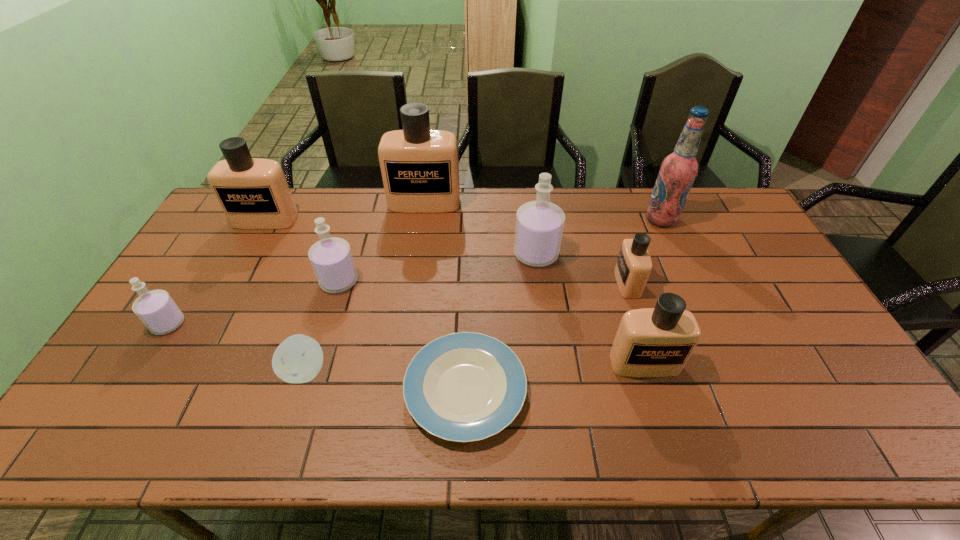
Identify the location of the third biggest beige perfume. (651, 342).

What are the coordinates of `the smallest beige perfume` in the screenshot? It's located at (634, 264).

Where is `the seventh farthest object`? Image resolution: width=960 pixels, height=540 pixels. the seventh farthest object is located at coordinates (156, 309).

You are a GUI agent. You are given a task and a screenshot of the screen. Output one action in this format:
    pyautogui.click(x=<x>, y=<y>)
    Task: Click on the leftmost purple perfume
    
    Given the screenshot: What is the action you would take?
    pyautogui.click(x=156, y=309)

Locate an element on the screen. The width and height of the screenshot is (960, 540). white apple is located at coordinates (298, 359).

At what (x,y) coordinates should I click in order to perform the action: click on apple. Please return your answer as a coordinate pair (x, y). Looking at the image, I should click on (298, 359).

This screenshot has width=960, height=540. What are the coordinates of `the shortest object` in the screenshot? It's located at (463, 387).

Where is `blue plate`? Image resolution: width=960 pixels, height=540 pixels. blue plate is located at coordinates (463, 387).

In order to click on vacant position located 0.150m on the front of the blue alcohol in this screenshot , I will do `click(680, 260)`.

Locate an element on the screen. free space located on the front label of the tallest perfume is located at coordinates (418, 252).